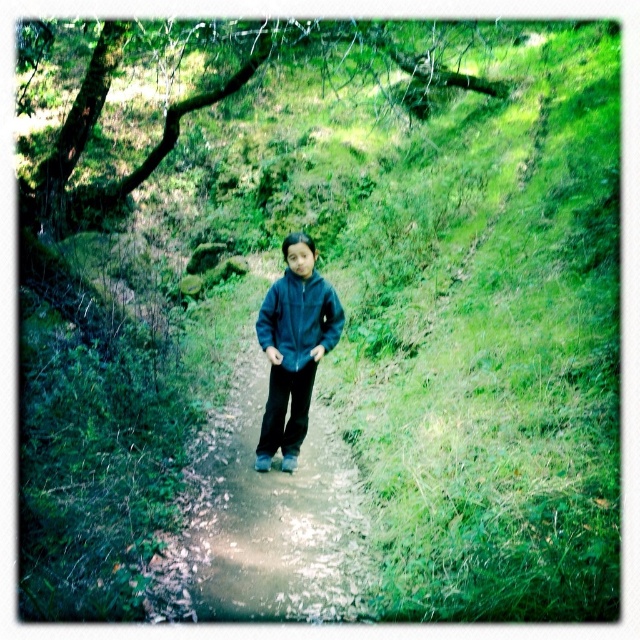
Question: Is dark blue fleece jacket at center above matte blue jacket at center?

Choices:
 (A) yes
 (B) no

Answer: (B)

Question: Which point is farther from the camera taking this photo?

Choices:
 (A) (282, 348)
 (B) (269, 298)

Answer: (B)

Question: Is dark blue fleece jacket at center positioned behind matte blue jacket at center?

Choices:
 (A) yes
 (B) no

Answer: (B)

Question: Does dark blue fleece jacket at center appear on the left side of matte blue jacket at center?

Choices:
 (A) no
 (B) yes

Answer: (B)

Question: Which object is farther from the camera taking this photo?

Choices:
 (A) matte blue jacket at center
 (B) dark blue fleece jacket at center

Answer: (A)